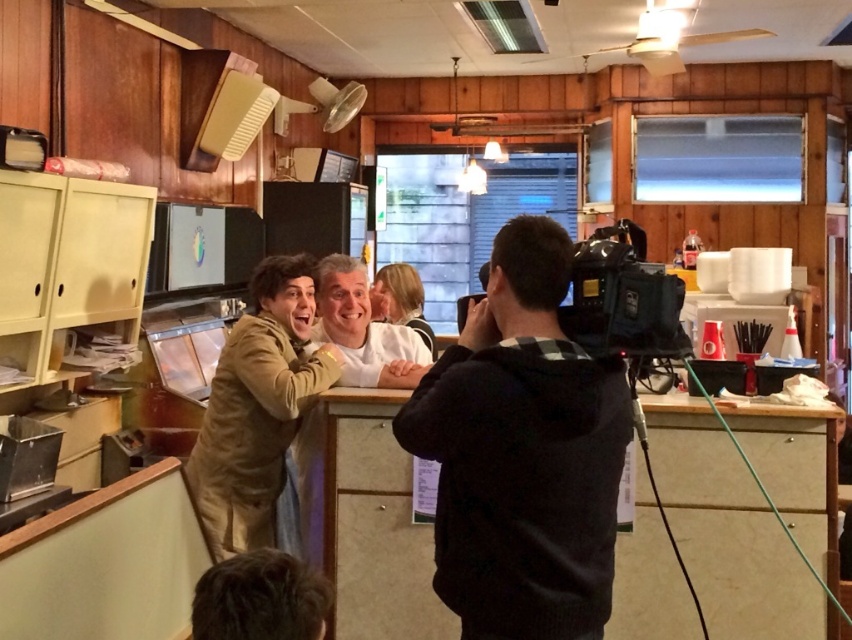
Question: Which object appears closest to the camera in this image?

Choices:
 (A) black fabric camera at center
 (B) tan suede jacket at center

Answer: (A)

Question: Can you confirm if black fabric camera at center is bigger than tan suede jacket at center?

Choices:
 (A) yes
 (B) no

Answer: (B)

Question: Considering the relative positions of black fabric camera at center and tan suede jacket at center in the image provided, where is black fabric camera at center located with respect to tan suede jacket at center?

Choices:
 (A) right
 (B) left

Answer: (A)

Question: Which point appears closest to the camera in this image?

Choices:
 (A) (213, 484)
 (B) (430, 454)

Answer: (B)

Question: Does black fabric camera at center appear under tan suede jacket at center?

Choices:
 (A) no
 (B) yes

Answer: (A)